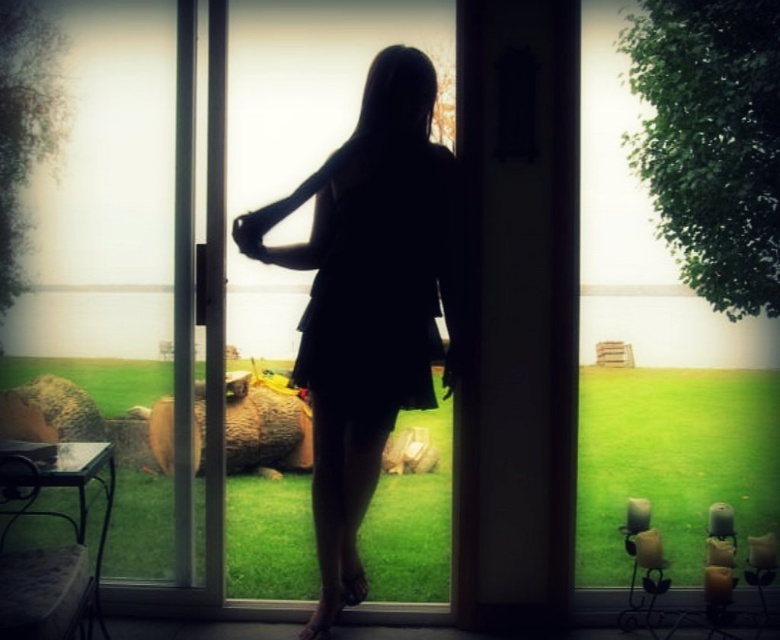
Can you confirm if transparent glass window at center is taller than silhouette dress at center?

Yes.

In the scene shown: Does transparent glass window at center lie behind silhouette dress at center?

That is True.

This screenshot has width=780, height=640. Identify the location of transparent glass window at center. (658, 355).

Locate an element on the screen. Image resolution: width=780 pixels, height=640 pixels. transparent glass window at center is located at coordinates (658, 355).